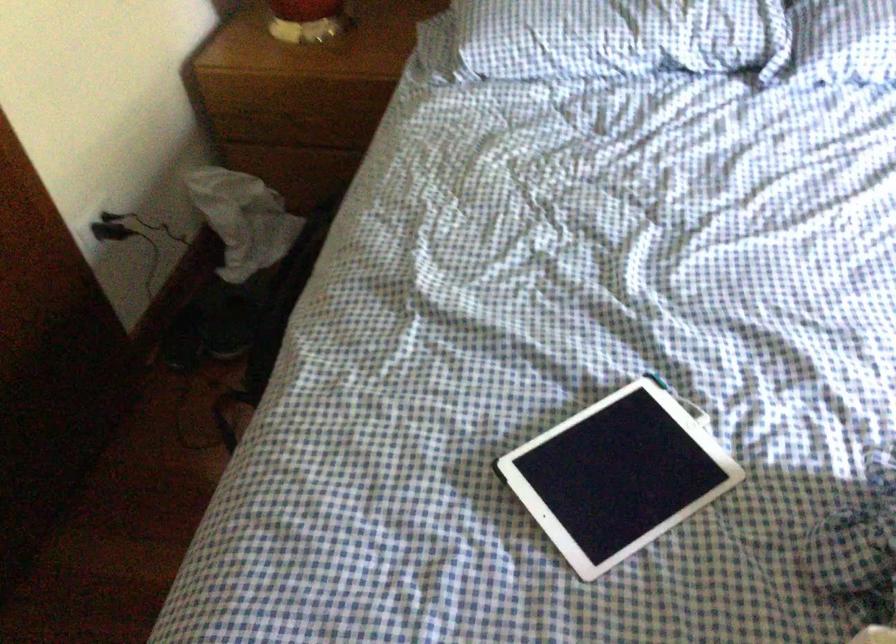
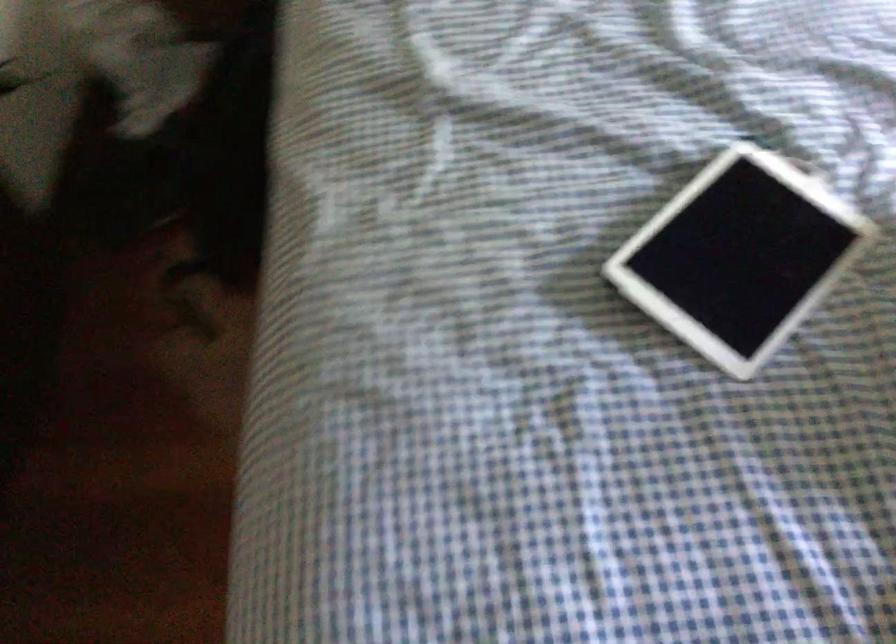
Where in the second image is the point corresponding to the point at 617,473 from the first image?

(739, 256)